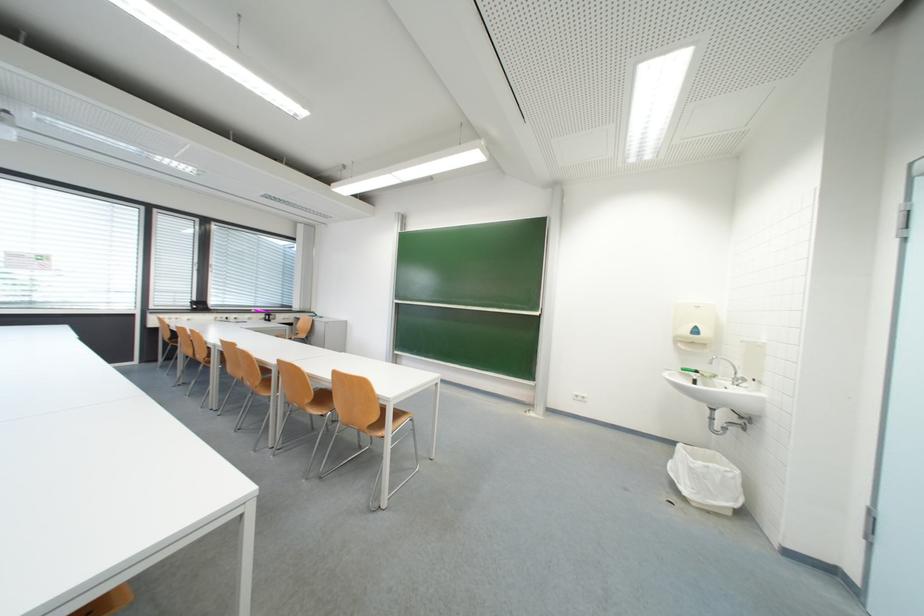
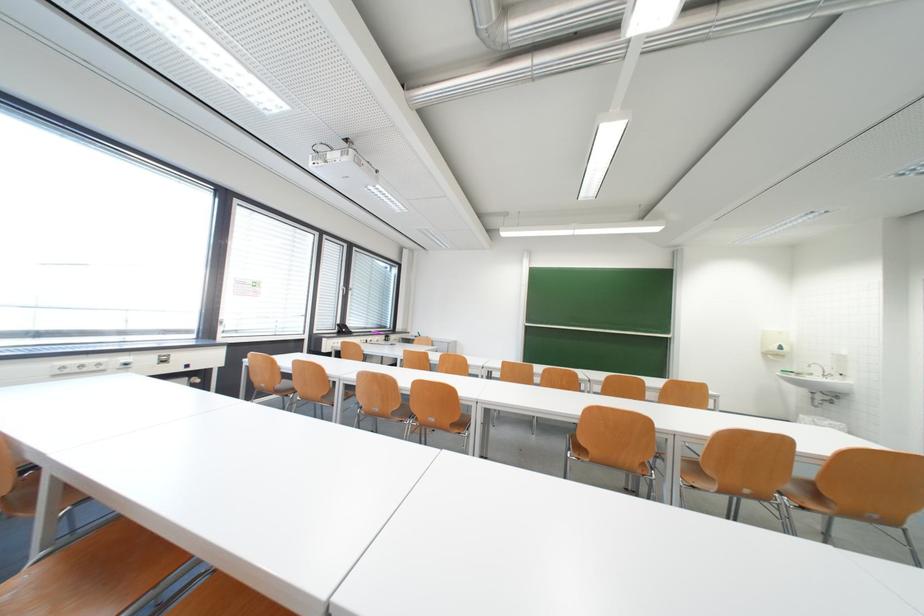
Question: The images are taken continuously from a first-person perspective. In which direction are you moving?

Choices:
 (A) Left
 (B) Right
 (C) Forward
 (D) Backward

Answer: (A)